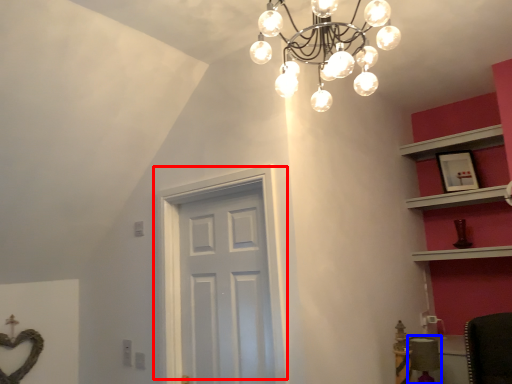
Question: Which object is further to the camera taking this photo, door (highlighted by a red box) or chair (highlighted by a blue box)?

Choices:
 (A) door
 (B) chair

Answer: (B)